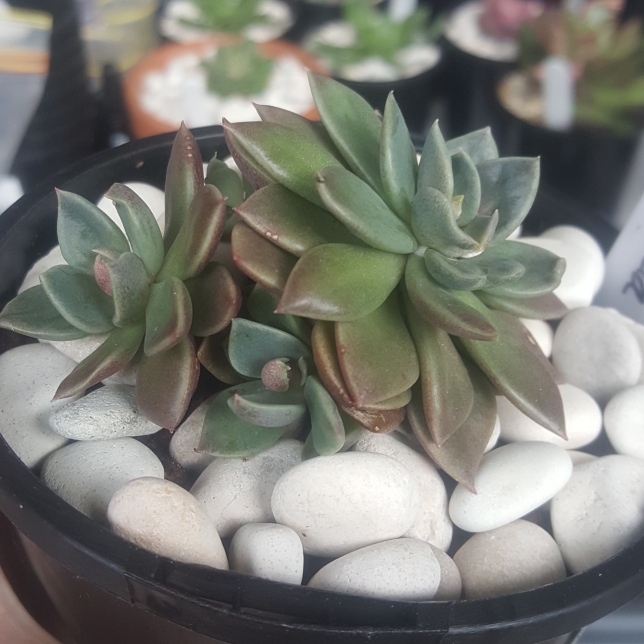
This screenshot has height=644, width=644. Find the location of `pot`. pot is located at coordinates (98, 576), (143, 153), (607, 579).